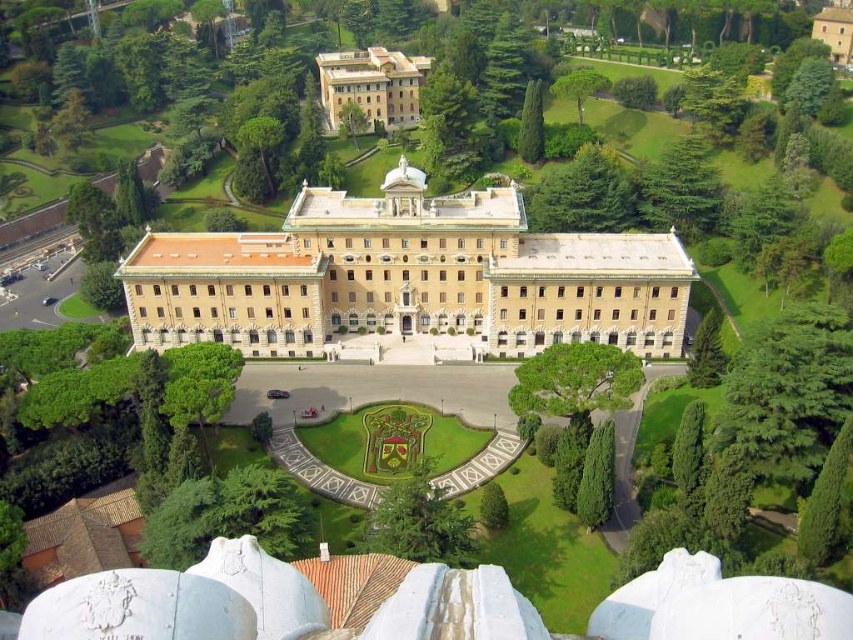
Can you confirm if beige stone building at center is positioned to the left of beige stone building at upper center?

Incorrect, beige stone building at center is not on the left side of beige stone building at upper center.

Does point (206, 339) come behind point (398, 120)?

No, (206, 339) is closer to viewer.

At what (x,y) coordinates should I click in order to perform the action: click on beige stone building at center. Please return your answer as a coordinate pair (x, y). The image size is (853, 640). Looking at the image, I should click on (407, 278).